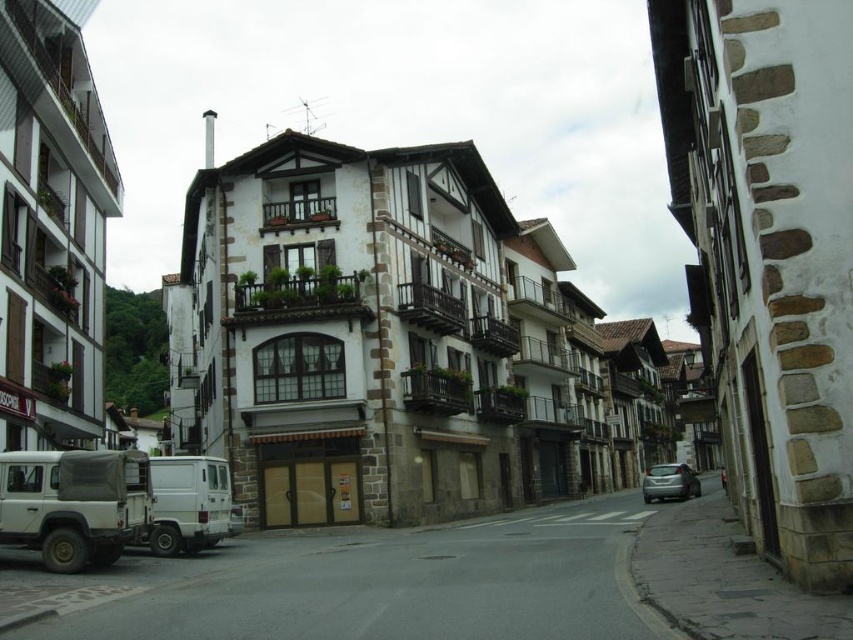
Does point (51, 486) come closer to viewer compared to point (224, 483)?

Yes, point (51, 486) is in front of point (224, 483).

Can you confirm if matte white van at lower left is thinner than white matte van at lower left?

Yes, matte white van at lower left is thinner than white matte van at lower left.

I want to click on matte white van at lower left, so click(x=74, y=502).

Where is `matte white van at lower left`? This screenshot has height=640, width=853. matte white van at lower left is located at coordinates (74, 502).

Is point (155, 502) farther from camera compared to point (674, 492)?

No, it is in front of (674, 492).

Which is behind, point (222, 460) or point (689, 490)?

Point (689, 490)

Where is `white matte van at lower left`? The width and height of the screenshot is (853, 640). white matte van at lower left is located at coordinates (189, 502).

Who is more distant from viewer, (24, 516) or (646, 493)?

Positioned behind is point (646, 493).

You are a GUI agent. You are given a task and a screenshot of the screen. Output one action in this format:
    pyautogui.click(x=<x>, y=<y>)
    Task: Click on the matte white van at lower left
    This screenshot has height=640, width=853.
    Given the screenshot: What is the action you would take?
    pyautogui.click(x=74, y=502)